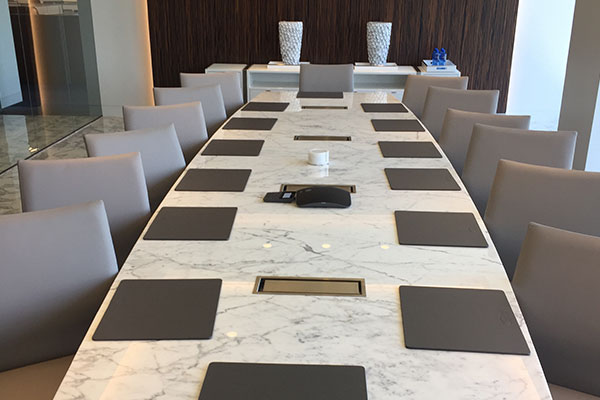
You are a GUI agent. You are given a task and a screenshot of the screen. Output one action in this format:
    pyautogui.click(x=<x>, y=<y>)
    Task: Click on the another shredder
    
    Given the screenshot: What is the action you would take?
    pyautogui.click(x=443, y=71)